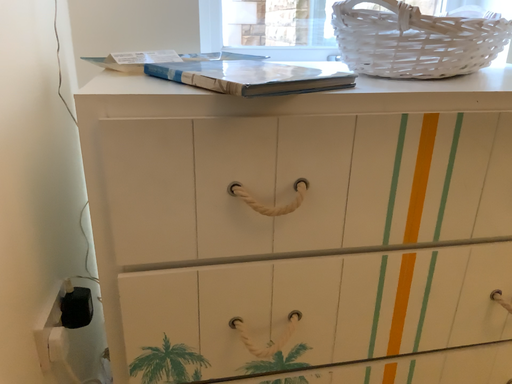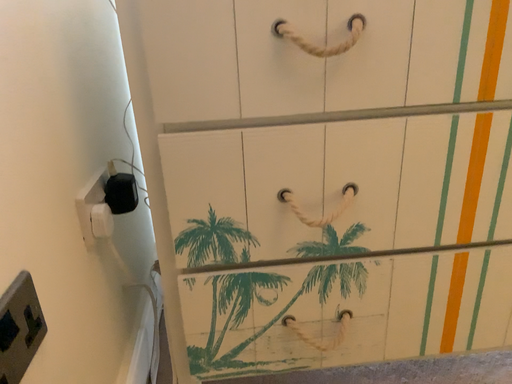
Question: Which way did the camera rotate in the video?

Choices:
 (A) rotated left
 (B) rotated right

Answer: (A)